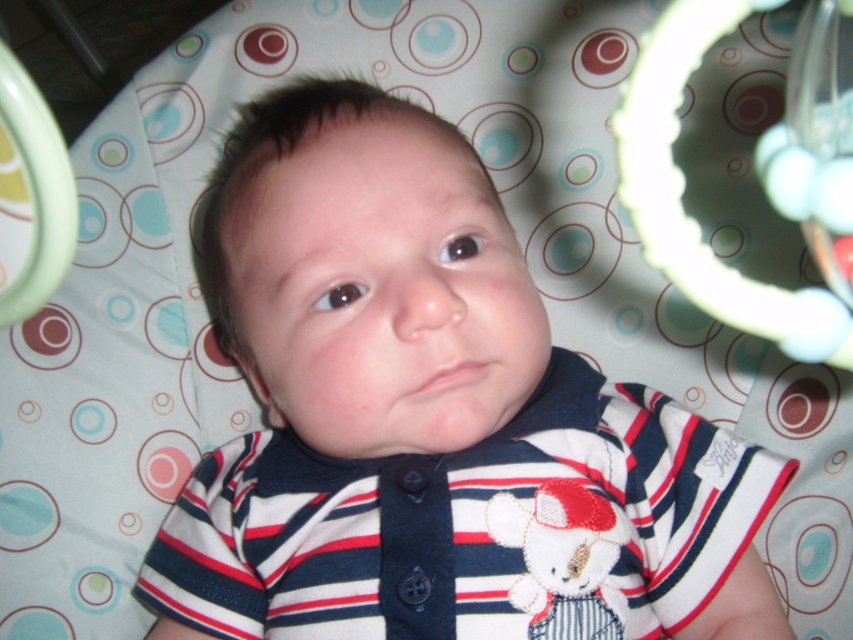
Can you confirm if white plastic teething ring at upper right is bigger than white plush bear at center?

Yes, white plastic teething ring at upper right is bigger than white plush bear at center.

Who is taller, white plastic teething ring at upper right or white plush bear at center?

white plastic teething ring at upper right is taller.

Is point (671, 26) behind point (602, 589)?

No, (671, 26) is closer to viewer.

Find the location of a particular element. The width and height of the screenshot is (853, 640). white plastic teething ring at upper right is located at coordinates (683, 189).

Is striped cotton shirt at center further to the viewer compared to white plush bear at center?

No, striped cotton shirt at center is closer to the viewer.

Between striped cotton shirt at center and white plush bear at center, which one has more height?

striped cotton shirt at center is taller.

Between point (508, 381) and point (550, 536), which one is positioned in front?

Point (508, 381) is more forward.

Where is `striped cotton shirt at center`? The height and width of the screenshot is (640, 853). striped cotton shirt at center is located at coordinates (431, 419).

Is point (509, 237) closer to camera compared to point (641, 225)?

That is False.

Which is above, striped cotton shirt at center or white plastic teething ring at upper right?

white plastic teething ring at upper right is above.

What do you see at coordinates (431, 419) in the screenshot? Image resolution: width=853 pixels, height=640 pixels. I see `striped cotton shirt at center` at bounding box center [431, 419].

In order to click on striped cotton shirt at center in this screenshot , I will do `click(431, 419)`.